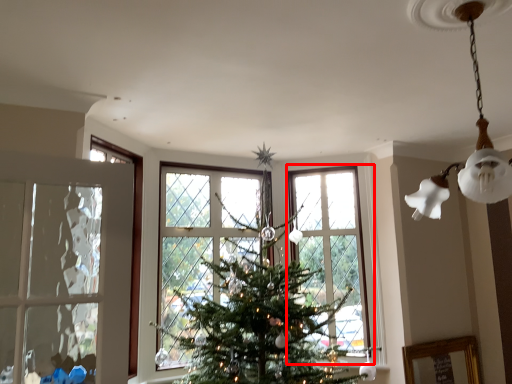
Question: In this image, where is window (annotated by the red box) located relative to lamp?

Choices:
 (A) right
 (B) left

Answer: (B)